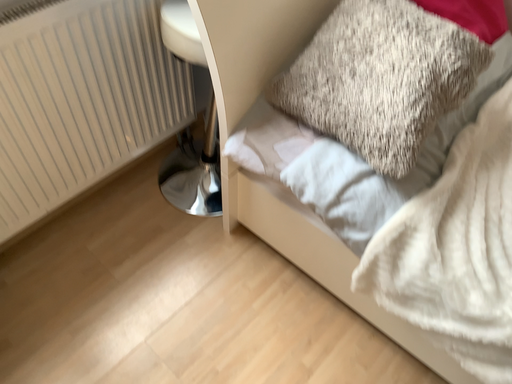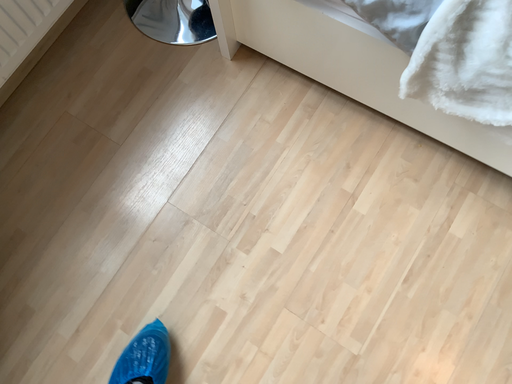
Question: How did the camera likely rotate when shooting the video?

Choices:
 (A) rotated downward
 (B) rotated upward

Answer: (A)